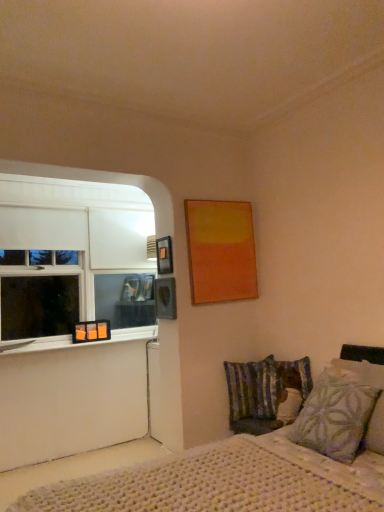
At what (x,y) coordinates should I click in order to perform the action: click on blank space above clear glass window sill at lower left (from a real-world perspective). Please return your answer as a coordinate pair (x, y). The width and height of the screenshot is (384, 512). Looking at the image, I should click on (79, 342).